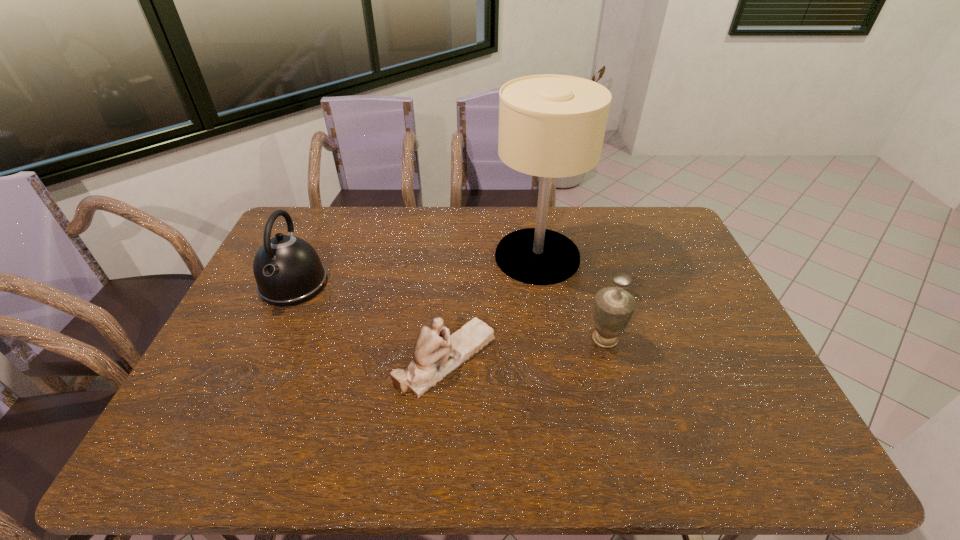
The width and height of the screenshot is (960, 540). I want to click on free space between the leftmost object and the urn, so click(449, 311).

Find the location of a particular element. free space between the table lamp and the leftmost object is located at coordinates (416, 270).

Find the location of a particular element. This screenshot has height=540, width=960. vacant space in between the tallest object and the urn is located at coordinates (571, 298).

Identify the location of free point between the leftmost object and the figurine. (371, 321).

Locate an element on the screen. vacant space that's between the shortest object and the table lamp is located at coordinates (492, 307).

Where is `free space between the shortest object and the tallest object`? This screenshot has width=960, height=540. free space between the shortest object and the tallest object is located at coordinates (492, 307).

Choose which object is the third nearest neighbor to the table lamp. Please provide its 2D coordinates. Your answer should be formatted as a tuple, i.e. [(x, y)], where the tuple contains the x and y coordinates of a point satisfying the conditions above.

[(288, 271)]

Image resolution: width=960 pixels, height=540 pixels. Identify the location of object that is the third nearest to the urn. (288, 271).

I want to click on free region that satisfies the following two spatial constraints: 1. on the front side of the urn; 2. on the right side of the tallest object, so click(550, 339).

The image size is (960, 540). Identify the location of vacant space that satisfies the following two spatial constraints: 1. on the front side of the tallest object; 2. on the front-facing side of the second object from left to right. (553, 358).